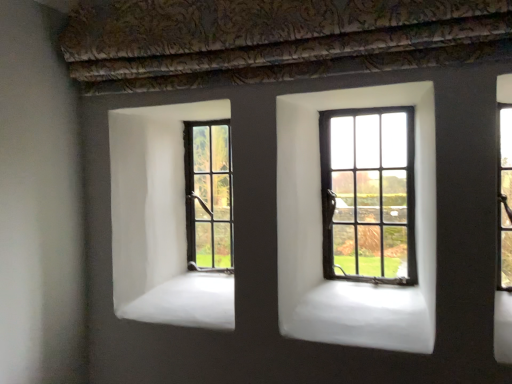
Question: Is dark brown wooden window at center left, the 2th window from the front, taller or shorter than dark brown wooden window at center, marked as the 1th window in a right-to-left arrangement?

Choices:
 (A) tall
 (B) short

Answer: (B)

Question: From the image's perspective, is dark brown wooden window at center left, the 1th window when ordered from back to front, above or below dark brown wooden window at center, marked as the 1th window in a right-to-left arrangement?

Choices:
 (A) above
 (B) below

Answer: (B)

Question: From a real-world perspective, is dark brown wooden window at center left, marked as the 1th window in a left-to-right arrangement, positioned above or below dark brown wooden window at center, acting as the second window starting from the left?

Choices:
 (A) above
 (B) below

Answer: (B)

Question: Considering their positions, is dark brown wooden window at center, which is counted as the 1th window, starting from the front, located in front of or behind dark brown wooden window at center left, the 2th window from the front?

Choices:
 (A) front
 (B) behind

Answer: (A)

Question: Do you think dark brown wooden window at center, which ranks as the 2th window in back-to-front order, is within dark brown wooden window at center left, the 2th window from the right, or outside of it?

Choices:
 (A) inside
 (B) outside

Answer: (B)

Question: From their relative heights in the image, would you say dark brown wooden window at center, which is counted as the 1th window, starting from the front, is taller or shorter than dark brown wooden window at center left, the 2th window from the front?

Choices:
 (A) short
 (B) tall

Answer: (B)

Question: Is point (374, 144) positioned closer to the camera than point (219, 216)?

Choices:
 (A) farther
 (B) closer

Answer: (B)